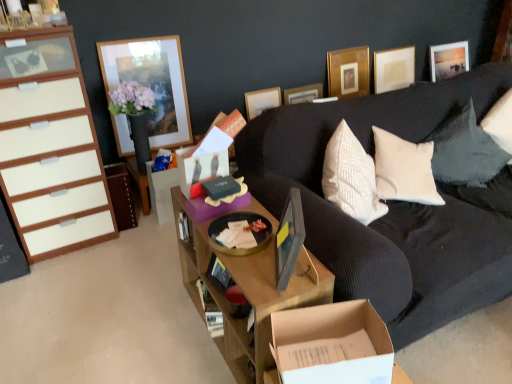
Question: From a real-world perspective, relative to wooden desk at center, is white glossy cabinet at left, acting as the second cabinetry starting from the right, vertically above or below?

Choices:
 (A) above
 (B) below

Answer: (A)

Question: Looking at the image, does white glossy cabinet at left, acting as the second cabinetry starting from the right, seem bigger or smaller compared to wooden desk at center?

Choices:
 (A) small
 (B) big

Answer: (B)

Question: Based on their relative distances, which object is farther from the matte gray picture frame at center, the 3th picture frame when ordered from left to right?

Choices:
 (A) wooden picture frame at upper center, which is counted as the third picture frame, starting from the front
 (B) black textured pillow at upper right
 (C) wooden desk at center
 (D) matte white picture frame at upper right, marked as the fifth picture frame in a front-to-back arrangement
 (E) matte wooden picture frame at upper right, the 6th picture frame when ordered from front to back

Answer: (E)

Question: Which object is positioned farthest from the matte white picture frame at upper right, which ranks as the 2th picture frame in right-to-left order?

Choices:
 (A) matte wooden picture frame at upper right, marked as the first picture frame in a back-to-front arrangement
 (B) gold metallic picture frame at upper center, which is the third picture frame from back to front
 (C) matte brown cabinet at left, placed as the 2th cabinetry when sorted from left to right
 (D) wooden picture frame at upper center, the 2th picture frame when ordered from left to right
 (E) wooden picture frame at upper left, the second picture frame in the front-to-back sequence

Answer: (C)